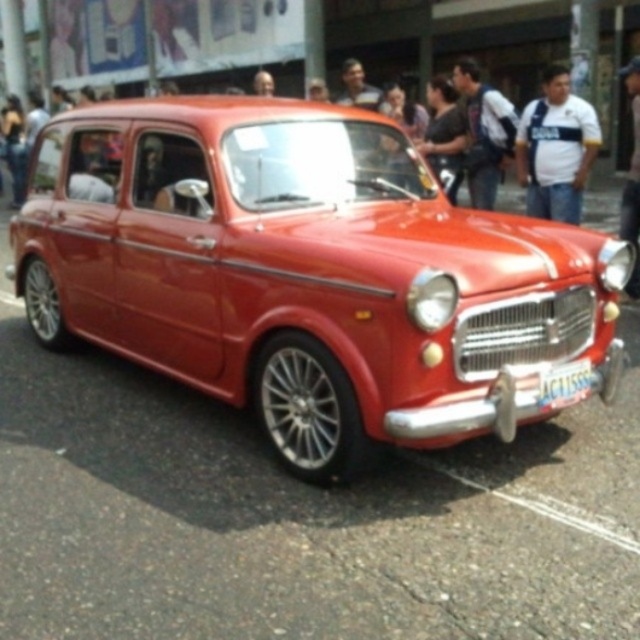
Question: Which point is closer to the camera taking this photo?

Choices:
 (A) (579, 385)
 (B) (442, 93)
 (C) (372, 312)

Answer: (C)

Question: Does shiny red car at center have a lesser width compared to white plastic license plate at center?

Choices:
 (A) yes
 (B) no

Answer: (B)

Question: Can you confirm if dark blue shirt at center is positioned above smooth leather jacket at upper right?

Choices:
 (A) no
 (B) yes

Answer: (A)

Question: Is the position of shiny red car at center more distant than that of dark blue shirt at center?

Choices:
 (A) yes
 (B) no

Answer: (B)

Question: Based on their relative distances, which object is farther from the matte black backpack at center?

Choices:
 (A) white plastic license plate at center
 (B) smooth leather jacket at upper right
 (C) shiny red car at center
 (D) dark blue shirt at center

Answer: (A)

Question: Which object is positioned farthest from the white striped shirt at center?

Choices:
 (A) shiny red car at center
 (B) smooth leather jacket at upper right
 (C) white plastic license plate at center
 (D) dark blue shirt at center

Answer: (A)